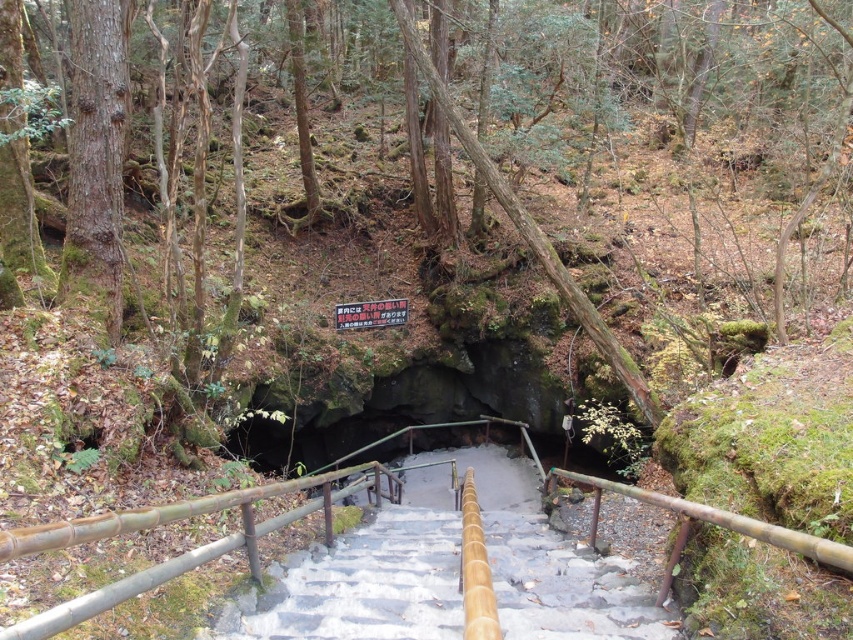
You are an explorer trying to navigate through the forest path towards the cave entrance. You see the green mossy rock at center and the black plastic sign at center. Which object is taller?

The green mossy rock at center is taller than the black plastic sign at center.

You are a hiker who wants to place a small backpack between the green mossy rock at center and the black plastic sign at center. Which object should you place the backpack closer to to ensure it fits within the space?

The green mossy rock at center is wider than the black plastic sign at center. To ensure the backpack fits, place it closer to the narrower black plastic sign at center.